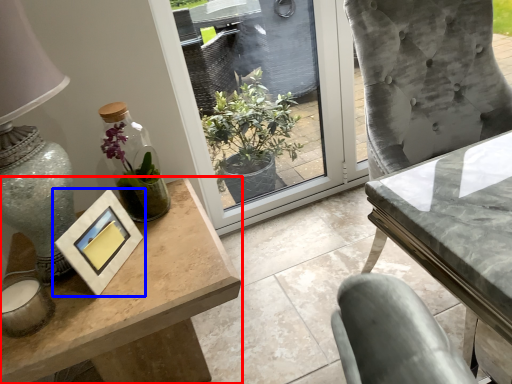
Question: Which of the following is the closest to the observer, table (highlighted by a red box) or picture frame (highlighted by a blue box)?

Choices:
 (A) table
 (B) picture frame

Answer: (A)